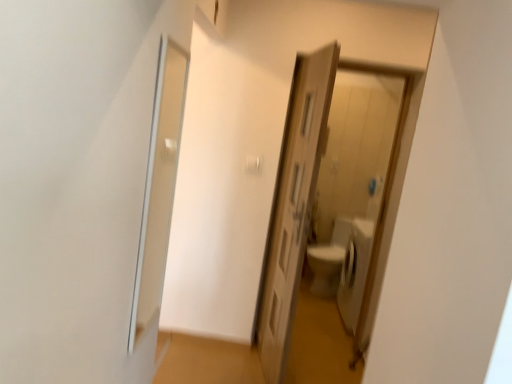
Where is `brown wooden door at center, the first path when ordered from front to back`? The image size is (512, 384). brown wooden door at center, the first path when ordered from front to back is located at coordinates pyautogui.click(x=204, y=361).

From the image's perspective, between brown wooden door at center, the first path when ordered from front to back, and wooden door at center, who is located below?

brown wooden door at center, the first path when ordered from front to back, is shown below in the image.

Consider the image. Which is behind, brown wooden door at center, which is the second path from back to front, or wooden door at center?

brown wooden door at center, which is the second path from back to front.

Between white glossy toilet at center, marked as the second path in a front-to-back arrangement, and brown wooden door at center, which is the second path from back to front, which one has less height?

brown wooden door at center, which is the second path from back to front.

From the image's perspective, which object appears higher, white glossy toilet at center, marked as the second path in a front-to-back arrangement, or brown wooden door at center, the first path when ordered from front to back?

white glossy toilet at center, marked as the second path in a front-to-back arrangement.

Considering the points (309, 356) and (258, 360), which point is in front, point (309, 356) or point (258, 360)?

Positioned in front is point (258, 360).

Is white glossy toilet at center, acting as the 1th path starting from the back, facing towards brown wooden door at center, the first path when ordered from front to back?

Yes, white glossy toilet at center, acting as the 1th path starting from the back, is facing brown wooden door at center, the first path when ordered from front to back.

From a real-world perspective, does wooden door at center sit lower than brown wooden door at center, which is the second path from back to front?

Incorrect, from a real-world perspective, wooden door at center is higher than brown wooden door at center, which is the second path from back to front.

Is point (315, 182) closer or farther from the camera than point (158, 339)?

Point (315, 182) is positioned closer to the camera compared to point (158, 339).

Is wooden door at center positioned with its back to brown wooden door at center, which is the second path from back to front?

That's not correct — wooden door at center is not looking away from brown wooden door at center, which is the second path from back to front.

Considering the relative positions of wooden door at center and brown wooden door at center, which is the second path from back to front, in the image provided, is wooden door at center to the left of brown wooden door at center, which is the second path from back to front, from the viewer's perspective?

Incorrect, wooden door at center is not on the left side of brown wooden door at center, which is the second path from back to front.

Based on their positions, is brown wooden door at center, the first path when ordered from front to back, located to the left or right of transparent glass screen door at left?

Clearly, brown wooden door at center, the first path when ordered from front to back, is on the right of transparent glass screen door at left in the image.

Is brown wooden door at center, which is the second path from back to front, wider or thinner than transparent glass screen door at left?

Considering their sizes, brown wooden door at center, which is the second path from back to front, looks broader than transparent glass screen door at left.

In the scene shown: Is the depth of brown wooden door at center, which is the second path from back to front, greater than that of transparent glass screen door at left?

Yes, brown wooden door at center, which is the second path from back to front, is further from the viewer.

From the image's perspective, is brown wooden door at center, which is the second path from back to front, over transparent glass screen door at left?

Incorrect, from the image's perspective, brown wooden door at center, which is the second path from back to front, is lower than transparent glass screen door at left.

Is white glossy toilet at center, marked as the second path in a front-to-back arrangement, surrounded by transparent glass screen door at left?

That's incorrect, white glossy toilet at center, marked as the second path in a front-to-back arrangement, is not inside transparent glass screen door at left.

Does transparent glass screen door at left lie behind white glossy toilet at center, acting as the 1th path starting from the back?

No.

Which of these two, transparent glass screen door at left or white glossy toilet at center, marked as the second path in a front-to-back arrangement, is smaller?

transparent glass screen door at left.

From the image's perspective, which path is the 1st one below the wooden door at center? Please provide its 2D coordinates.

[(319, 343)]

What's the angular difference between white glossy toilet at center, acting as the 1th path starting from the back, and wooden door at center's facing directions?

The facing directions of white glossy toilet at center, acting as the 1th path starting from the back, and wooden door at center are 101 degrees apart.

Is white glossy toilet at center, acting as the 1th path starting from the back, inside the boundaries of wooden door at center, or outside?

white glossy toilet at center, acting as the 1th path starting from the back, lies outside wooden door at center.

Considering the relative sizes of white glossy toilet at center, acting as the 1th path starting from the back, and wooden door at center in the image provided, is white glossy toilet at center, acting as the 1th path starting from the back, thinner than wooden door at center?

No, white glossy toilet at center, acting as the 1th path starting from the back, is not thinner than wooden door at center.

Is transparent glass screen door at left wider than brown wooden door at center, which is the second path from back to front?

No, transparent glass screen door at left is not wider than brown wooden door at center, which is the second path from back to front.

Is transparent glass screen door at left in front of or behind brown wooden door at center, the first path when ordered from front to back, in the image?

transparent glass screen door at left is positioned closer to the viewer than brown wooden door at center, the first path when ordered from front to back.

Does transparent glass screen door at left turn towards brown wooden door at center, which is the second path from back to front?

No.

From a real-world perspective, is transparent glass screen door at left below brown wooden door at center, the first path when ordered from front to back?

No, from a real-world perspective, transparent glass screen door at left is not beneath brown wooden door at center, the first path when ordered from front to back.

Identify the location of door on the right of the brown wooden door at center, the first path when ordered from front to back. (293, 205).

The width and height of the screenshot is (512, 384). Identify the location of path below the white glossy toilet at center, marked as the second path in a front-to-back arrangement (from the image's perspective). (204, 361).

Which object lies nearer to the anchor point wooden door at center, brown wooden door at center, the first path when ordered from front to back, or transparent glass screen door at left?

The object closer to wooden door at center is brown wooden door at center, the first path when ordered from front to back.

From the picture: When comparing their distances from white glossy toilet at center, marked as the second path in a front-to-back arrangement, does transparent glass screen door at left or brown wooden door at center, the first path when ordered from front to back, seem further?

The object further to white glossy toilet at center, marked as the second path in a front-to-back arrangement, is transparent glass screen door at left.

Consider the image. Based on their spatial positions, is transparent glass screen door at left or wooden door at center closer to brown wooden door at center, which is the second path from back to front?

Based on the image, wooden door at center appears to be nearer to brown wooden door at center, which is the second path from back to front.

From the picture: Which object lies nearer to the anchor point wooden door at center, brown wooden door at center, the first path when ordered from front to back, or white glossy toilet at center, marked as the second path in a front-to-back arrangement?

brown wooden door at center, the first path when ordered from front to back, is closer to wooden door at center.

Which object lies further to the anchor point white glossy toilet at center, marked as the second path in a front-to-back arrangement, brown wooden door at center, which is the second path from back to front, or transparent glass screen door at left?

transparent glass screen door at left lies further to white glossy toilet at center, marked as the second path in a front-to-back arrangement, than the other object.

From the image, which object appears to be farther from transparent glass screen door at left, white glossy toilet at center, marked as the second path in a front-to-back arrangement, or brown wooden door at center, the first path when ordered from front to back?

The object further to transparent glass screen door at left is white glossy toilet at center, marked as the second path in a front-to-back arrangement.

Considering their positions, is transparent glass screen door at left positioned closer to white glossy toilet at center, acting as the 1th path starting from the back, than wooden door at center?

The object closer to white glossy toilet at center, acting as the 1th path starting from the back, is wooden door at center.

Looking at the image, which one is located closer to transparent glass screen door at left, brown wooden door at center, the first path when ordered from front to back, or white glossy toilet at center, acting as the 1th path starting from the back?

brown wooden door at center, the first path when ordered from front to back.

Where is `path positioned between transparent glass screen door at left and white glossy toilet at center, acting as the 1th path starting from the back, from near to far`? The height and width of the screenshot is (384, 512). path positioned between transparent glass screen door at left and white glossy toilet at center, acting as the 1th path starting from the back, from near to far is located at coordinates (204, 361).

Identify the location of path between wooden door at center and brown wooden door at center, which is the second path from back to front, from top to bottom. Image resolution: width=512 pixels, height=384 pixels. (319, 343).

Locate an element on the screen. Image resolution: width=512 pixels, height=384 pixels. door between transparent glass screen door at left and brown wooden door at center, which is the second path from back to front, from top to bottom is located at coordinates (293, 205).

Locate an element on the screen. door located between transparent glass screen door at left and white glossy toilet at center, marked as the second path in a front-to-back arrangement, in the depth direction is located at coordinates (293, 205).